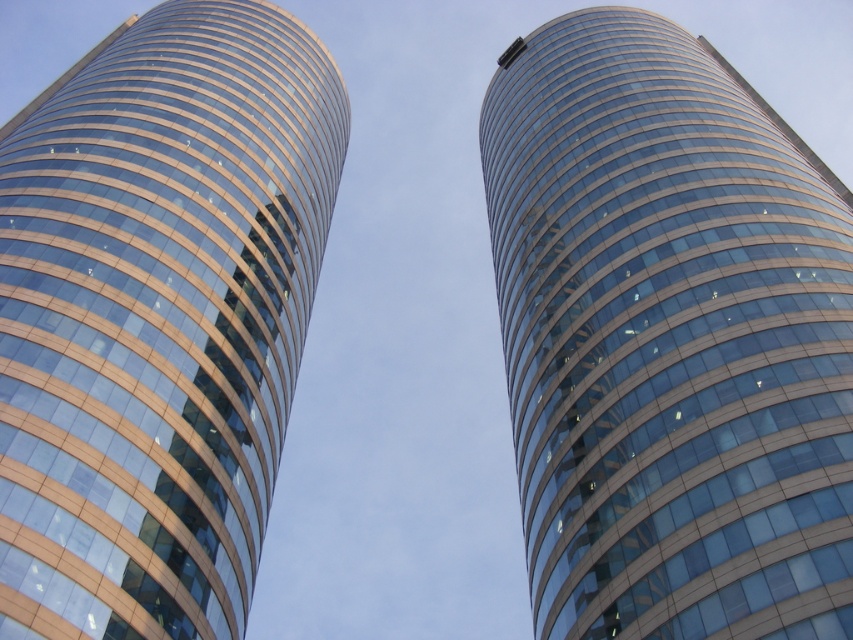
Question: Which point appears farthest from the camera in this image?

Choices:
 (A) (22, 508)
 (B) (573, 65)

Answer: (B)

Question: Which of the following is the closest to the observer?

Choices:
 (A) matte glass building at center
 (B) glassy blue skyscraper at center

Answer: (B)

Question: Can you confirm if glassy blue skyscraper at center is wider than matte glass building at center?

Choices:
 (A) yes
 (B) no

Answer: (B)

Question: Where is glassy blue skyscraper at center located in relation to matte glass building at center in the image?

Choices:
 (A) left
 (B) right

Answer: (B)

Question: Which of the following is the farthest from the observer?

Choices:
 (A) matte glass building at center
 (B) glassy blue skyscraper at center

Answer: (A)

Question: Is glassy blue skyscraper at center wider than matte glass building at center?

Choices:
 (A) yes
 (B) no

Answer: (B)